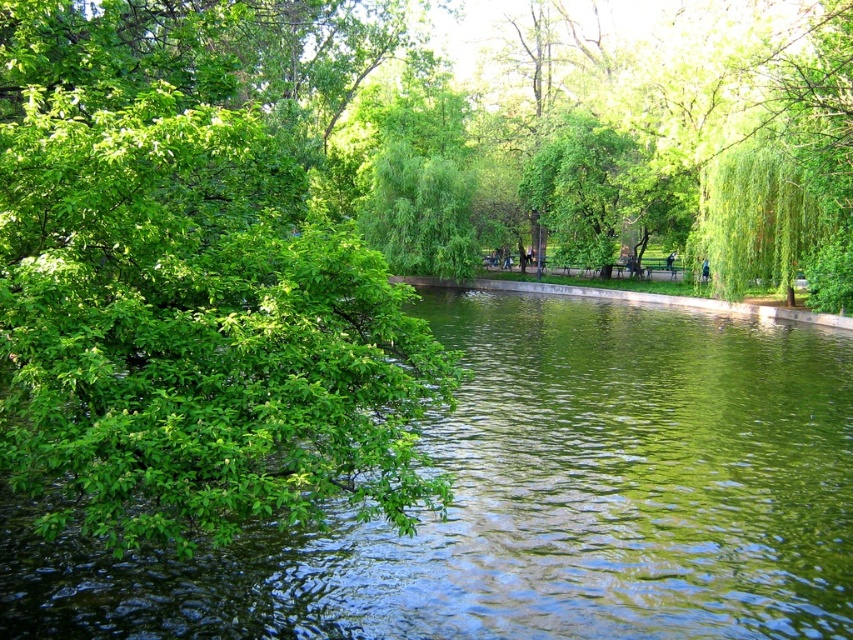
Question: Based on their relative distances, which object is farther from the green glossy water at center?

Choices:
 (A) green leafy tree at center
 (B) green leafy tree at upper right

Answer: (A)

Question: Considering the real-world distances, which object is closest to the green leafy tree at upper right?

Choices:
 (A) green leafy tree at center
 (B) green leafy tree at left
 (C) green glossy water at center

Answer: (C)

Question: Does green leafy tree at left have a smaller size compared to green leafy tree at center?

Choices:
 (A) no
 (B) yes

Answer: (A)

Question: From the image, what is the correct spatial relationship of green glossy water at center in relation to green leafy tree at upper right?

Choices:
 (A) right
 (B) left

Answer: (B)

Question: In this image, where is green leafy tree at upper right located relative to green leafy tree at center?

Choices:
 (A) above
 (B) below

Answer: (B)

Question: Which object is the farthest from the green leafy tree at upper right?

Choices:
 (A) green leafy tree at center
 (B) green glossy water at center
 (C) green leafy tree at left

Answer: (C)